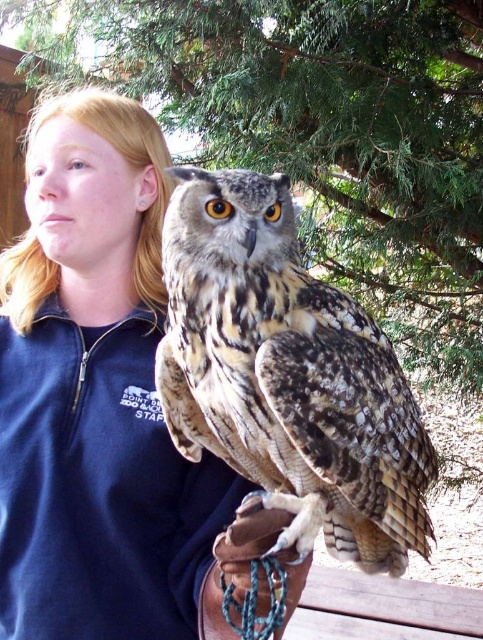
Question: Is blue fleece jacket at upper left above brown leather glove at lower center?

Choices:
 (A) no
 (B) yes

Answer: (B)

Question: Which point is closer to the camera?

Choices:
 (A) green leafy tree at upper center
 (B) brown leather glove at lower center

Answer: (B)

Question: Which point appears closest to the camera in this image?

Choices:
 (A) (162, 157)
 (B) (314, 196)
 (C) (282, 561)
 (D) (256, 371)

Answer: (C)

Question: Does green leafy tree at upper center appear under brown speckled feathers at center?

Choices:
 (A) yes
 (B) no

Answer: (B)

Question: Which point appears farthest from the camera in this image?

Choices:
 (A) (472, 360)
 (B) (206, 576)

Answer: (A)

Question: Is blue fleece jacket at upper left below green leafy tree at upper center?

Choices:
 (A) yes
 (B) no

Answer: (A)